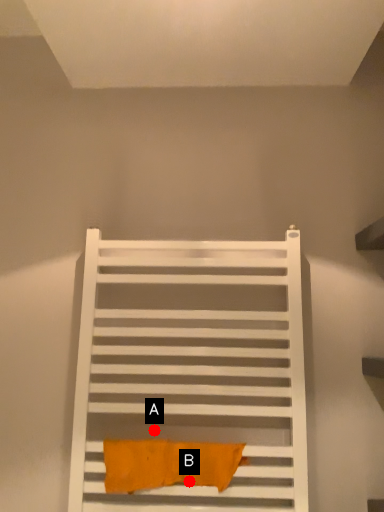
Question: Two points are circled on the image, labeled by A and B beside each circle. Among these points, which one is nearest to the camera?

Choices:
 (A) A is closer
 (B) B is closer

Answer: (B)